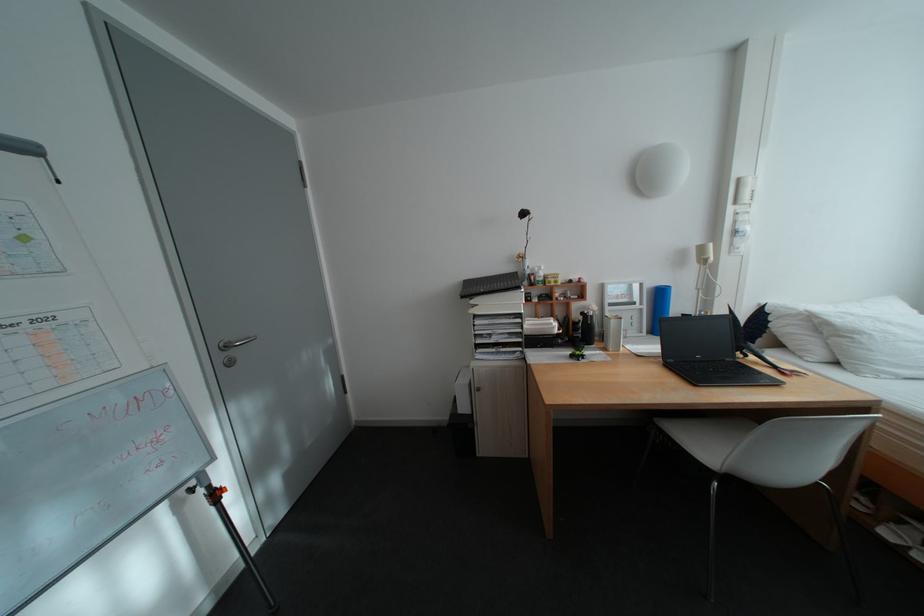
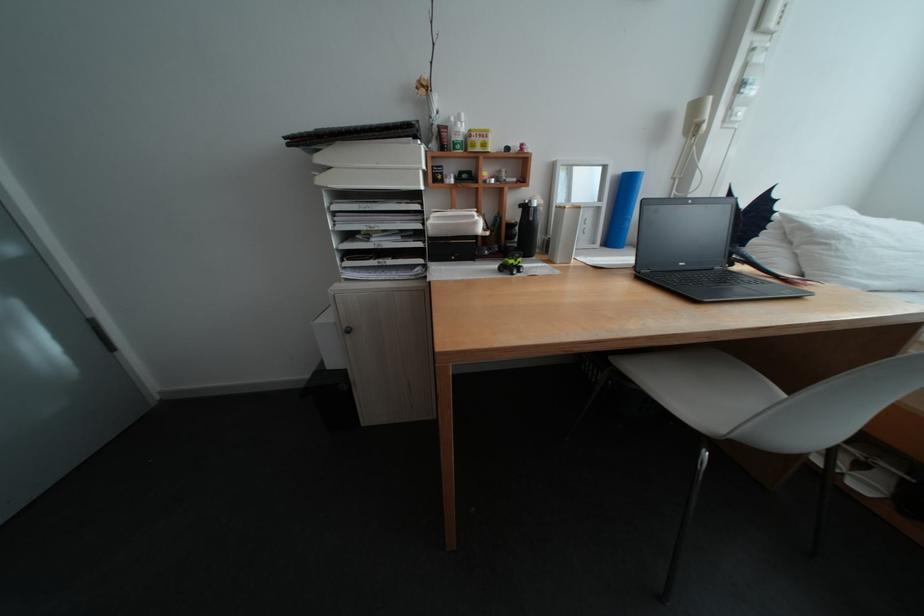
Find the pixel in the second image that matches pixel 657 307 in the first image.

(616, 205)